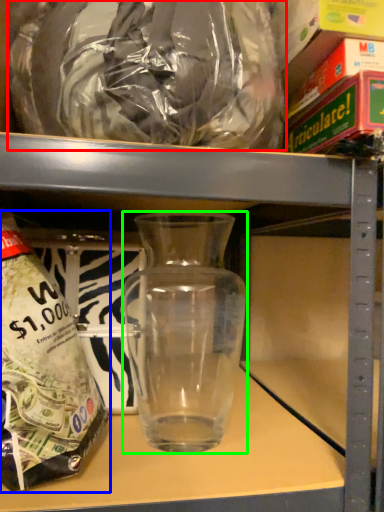
Question: Based on their relative distances, which object is nearer to plastic bag (highlighted by a red box)? Choose from bottle (highlighted by a blue box) and vase (highlighted by a green box).

Choices:
 (A) bottle
 (B) vase

Answer: (A)